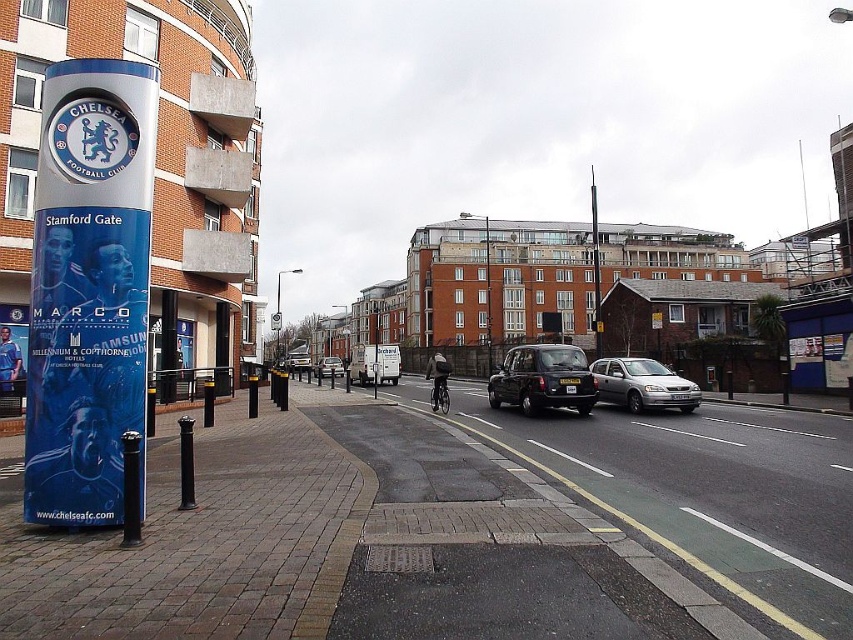
You are a pedestrian standing on the sidewalk in front of the Chelsea Football Club advertisement pillar. You want to cross the street to reach the Millennium Hotels. There is a silver metallic hatchback at center and a silver metallic van at center blocking your path. Which vehicle should you move around to get to the other side of both vehicles?

You should move around the silver metallic hatchback at center. Since it is in front of the silver metallic van at center, moving around the hatchback would allow you to reach the area behind both vehicles more easily.

You are a photographer standing on the sidewalk in front of the Chelsea Football Club advertisement pillar. You want to take a photo that includes both the point at coordinate (x=595, y=225) and the point at coordinate (x=341, y=364). Which point should you focus on first to ensure both are in sharp focus?

You should focus on point (x=341, y=364) first because it is closer to the camera than point (x=595, y=225). By focusing on the closer point, the farther point will also be within the depth of field and in focus.

You are a pedestrian standing on the sidewalk next to the Chelsea Football Club advertisement pillar. You want to cross the street to reach the other side. There is a black metallic taxi at center and a silver metallic van at center in your path. Which vehicle should you wait for first before proceeding?

You should wait for the black metallic taxi at center first because it is in front of the silver metallic van at center, meaning it will reach your crossing point sooner.